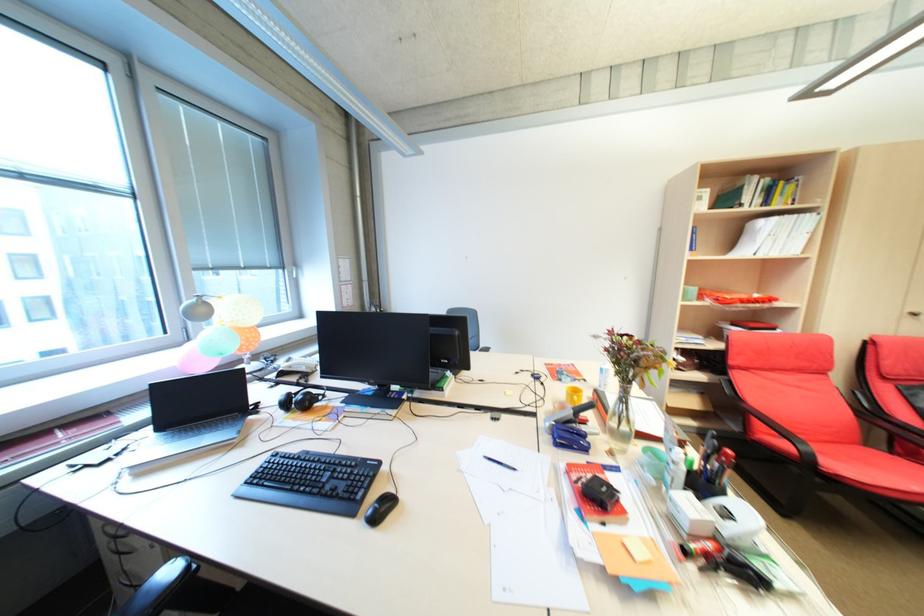
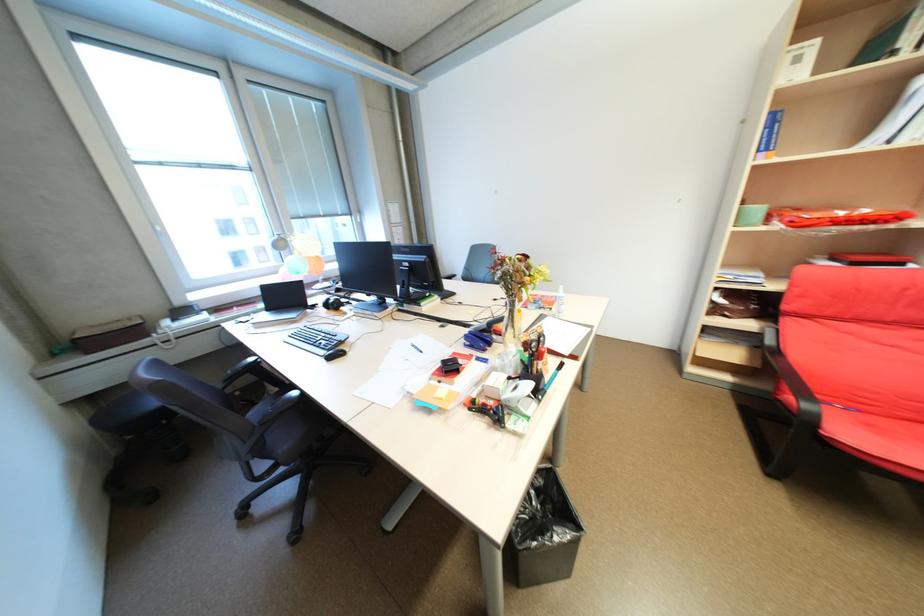
Question: How did the camera likely rotate?

Choices:
 (A) Left
 (B) Right
 (C) Up
 (D) Down

Answer: (A)